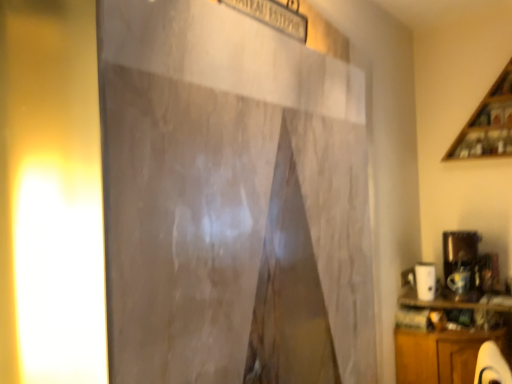
Question: From a real-world perspective, is yellow matte light at left physically above wooden at upper right?

Choices:
 (A) yes
 (B) no

Answer: (B)

Question: Is yellow matte light at left bigger than wooden at upper right?

Choices:
 (A) yes
 (B) no

Answer: (B)

Question: Is yellow matte light at left not within wooden at upper right?

Choices:
 (A) no
 (B) yes

Answer: (B)

Question: From a real-world perspective, is yellow matte light at left beneath wooden at upper right?

Choices:
 (A) yes
 (B) no

Answer: (A)

Question: Considering the relative sizes of yellow matte light at left and wooden at upper right in the image provided, is yellow matte light at left smaller than wooden at upper right?

Choices:
 (A) no
 (B) yes

Answer: (B)

Question: Does yellow matte light at left appear on the left side of wooden at upper right?

Choices:
 (A) no
 (B) yes

Answer: (B)

Question: Considering the relative sizes of yellow matte light at left and wooden cabinet at lower right in the image provided, is yellow matte light at left thinner than wooden cabinet at lower right?

Choices:
 (A) yes
 (B) no

Answer: (A)

Question: Is yellow matte light at left shorter than wooden cabinet at lower right?

Choices:
 (A) yes
 (B) no

Answer: (B)

Question: Is yellow matte light at left facing towards wooden cabinet at lower right?

Choices:
 (A) yes
 (B) no

Answer: (B)

Question: Is yellow matte light at left positioned before wooden cabinet at lower right?

Choices:
 (A) no
 (B) yes

Answer: (B)

Question: From the image's perspective, is yellow matte light at left located above wooden cabinet at lower right?

Choices:
 (A) yes
 (B) no

Answer: (A)

Question: Is yellow matte light at left smaller than wooden cabinet at lower right?

Choices:
 (A) yes
 (B) no

Answer: (A)

Question: Is wooden cabinet at lower right positioned before wooden at upper right?

Choices:
 (A) no
 (B) yes

Answer: (B)